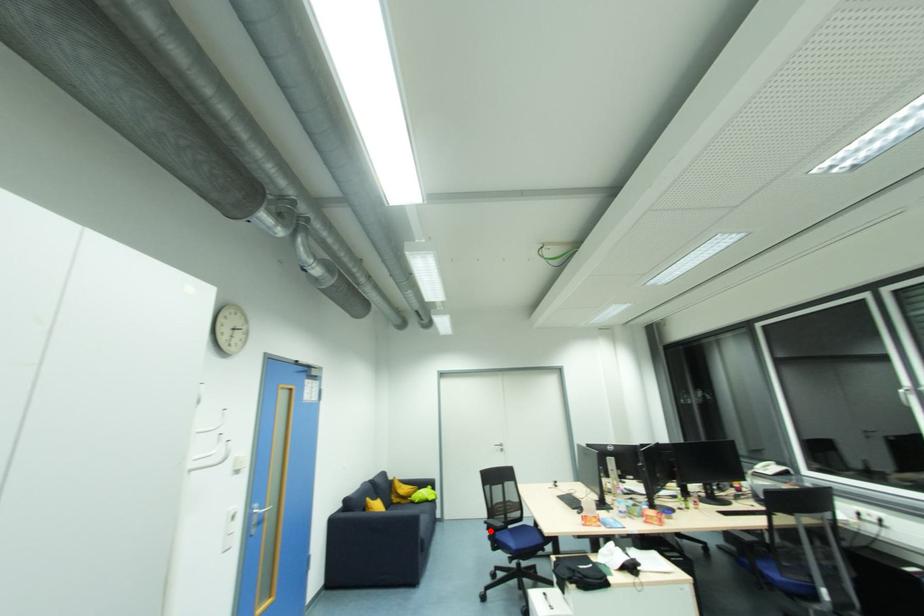
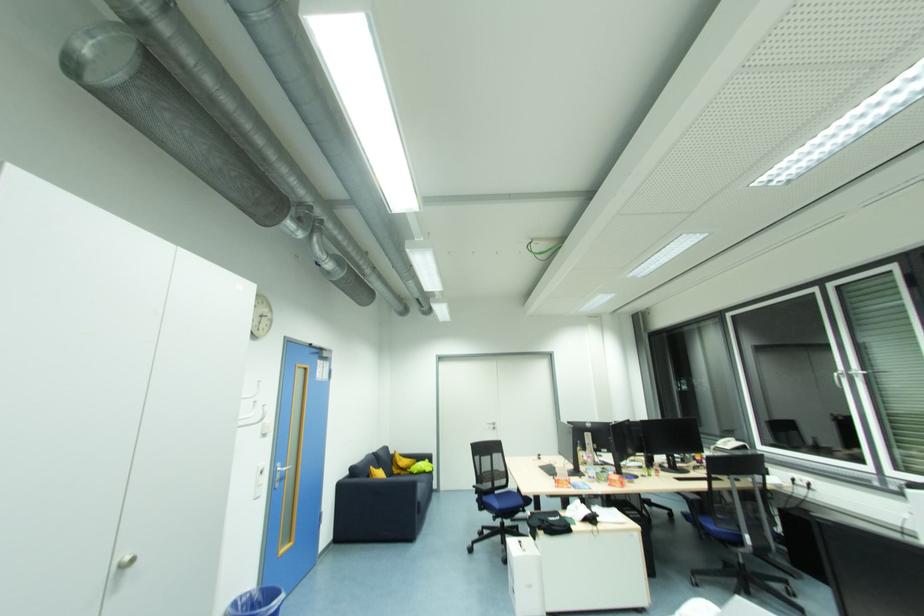
Question: I am providing you with two images of the same scene from different viewpoints. A red point is marked on the first image. At the location where the point appears in image 1, is it still visible in image 2?

Choices:
 (A) Yes
 (B) No

Answer: (A)